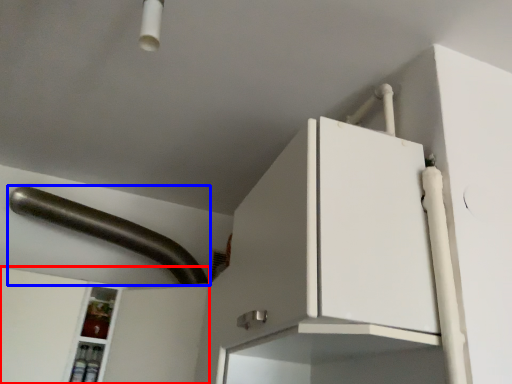
Question: Which object is further to the camera taking this photo, cabinetry (highlighted by a red box) or door handle (highlighted by a blue box)?

Choices:
 (A) cabinetry
 (B) door handle

Answer: (B)